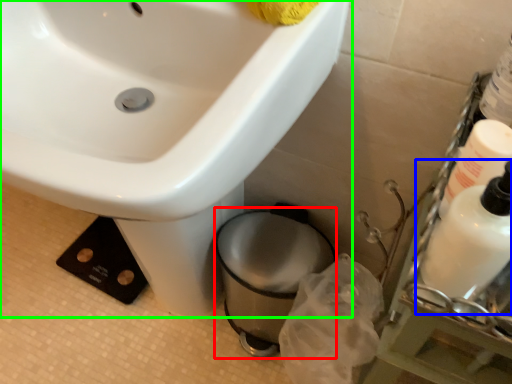
Question: Based on their relative distances, which object is farther from toilet bowl (highlighted by a red box)? Choose from cleaning product (highlighted by a blue box) and sink (highlighted by a green box).

Choices:
 (A) cleaning product
 (B) sink

Answer: (A)